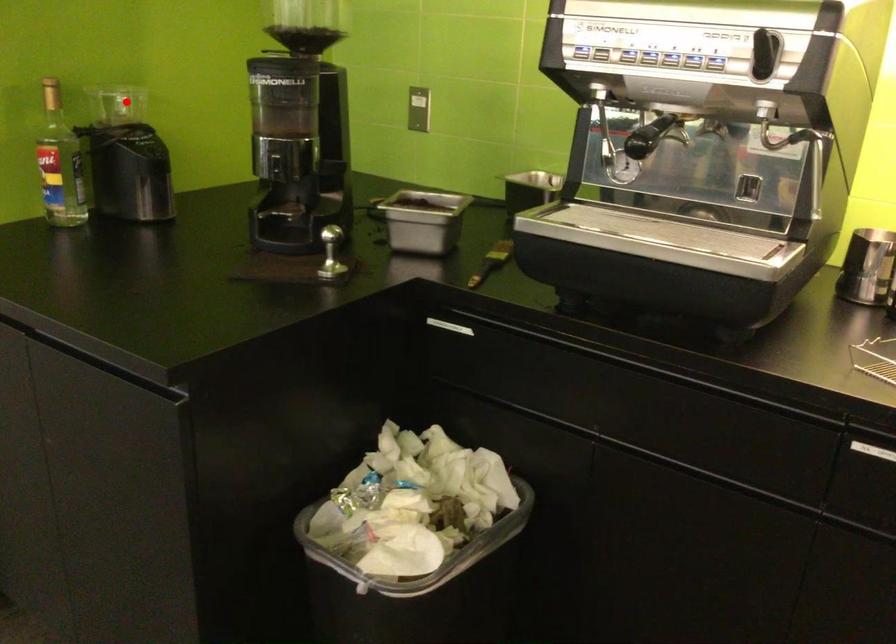
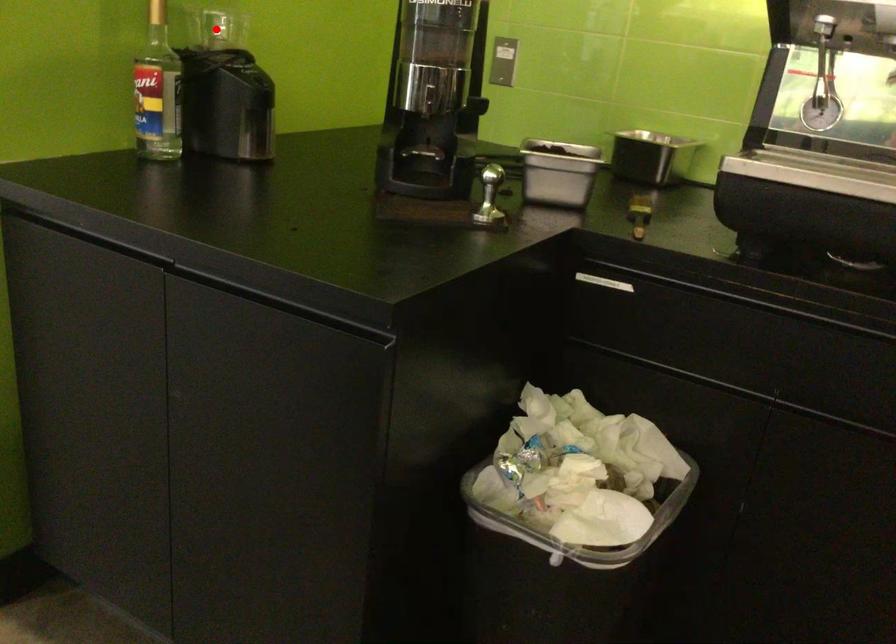
I am providing you with two images of the same scene from different viewpoints. A red point is marked on the first image and another point is marked on the second image. Is the marked point in image1 the same physical position as the marked point in image2?

A: Yes